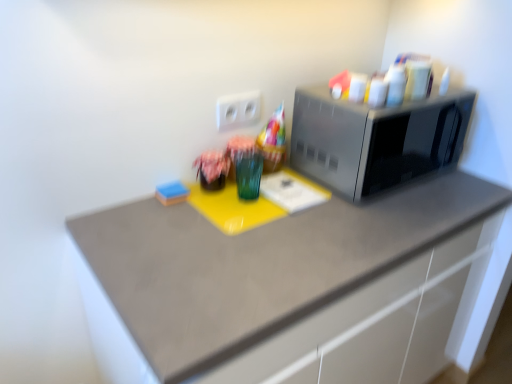
Identify the location of spots to the right of blue sponge at lower left. (224, 202).